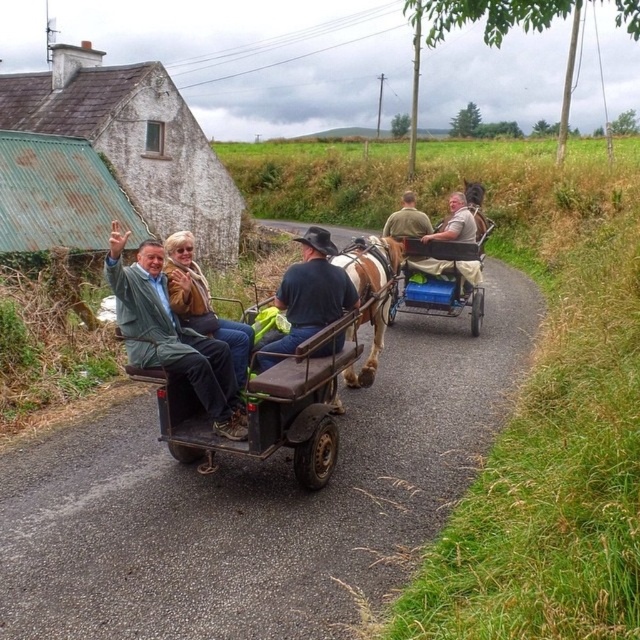
Can you confirm if green fabric jacket at center is shorter than light brown leather jacket at center?

Incorrect, green fabric jacket at center's height does not fall short of light brown leather jacket at center's.

Does green fabric jacket at center appear over light brown leather jacket at center?

No, green fabric jacket at center is not above light brown leather jacket at center.

Find the location of a particular element. green fabric jacket at center is located at coordinates (170, 333).

Does matte brown jacket at center appear on the left side of light brown leather jacket at center?

Indeed, matte brown jacket at center is positioned on the left side of light brown leather jacket at center.

Who is lower down, matte brown jacket at center or light brown leather jacket at center?

matte brown jacket at center is below.

Does point (214, 337) lie in front of point (458, 202)?

Yes, it is.

You are a GUI agent. You are given a task and a screenshot of the screen. Output one action in this format:
    pyautogui.click(x=<x>, y=<y>)
    Task: Click on the matte brown jacket at center
    
    Given the screenshot: What is the action you would take?
    pyautogui.click(x=202, y=301)

Who is positioned more to the left, dark blue denim jeans at center or wooden cart at center?

From the viewer's perspective, dark blue denim jeans at center appears more on the left side.

Between dark blue denim jeans at center and wooden cart at center, which one is positioned lower?

dark blue denim jeans at center is lower down.

Which is behind, point (349, 289) or point (422, 308)?

Positioned behind is point (422, 308).

In order to click on dark blue denim jeans at center in this screenshot , I will do `click(308, 296)`.